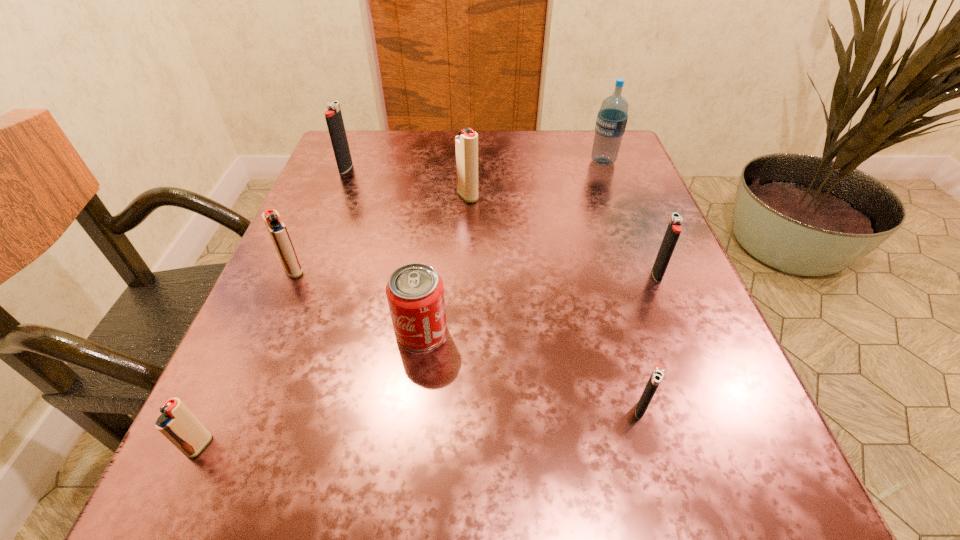
Where is `red igniter that is the third closest to the biggest black igniter`? red igniter that is the third closest to the biggest black igniter is located at coordinates (177, 423).

Select which red igniter is the second closest to the blue water bottle. Please provide its 2D coordinates. Your answer should be formatted as a tuple, i.e. [(x, y)], where the tuple contains the x and y coordinates of a point satisfying the conditions above.

[(276, 228)]

Identify the location of the second closest black igniter to the smallest red igniter. The height and width of the screenshot is (540, 960). (333, 116).

Choose which black igniter is the nearest neighbor to the smallest red igniter. Please provide its 2D coordinates. Your answer should be formatted as a tuple, i.e. [(x, y)], where the tuple contains the x and y coordinates of a point satisfying the conditions above.

[(657, 374)]

Identify the location of free region that satisfies the following two spatial constraints: 1. on the front side of the farthest red igniter; 2. on the right side of the leftmost black igniter. (335, 197).

Identify the location of free region that satisfies the following two spatial constraints: 1. on the front side of the fifth object from left to right; 2. on the right side of the smallest black igniter. The height and width of the screenshot is (540, 960). (461, 409).